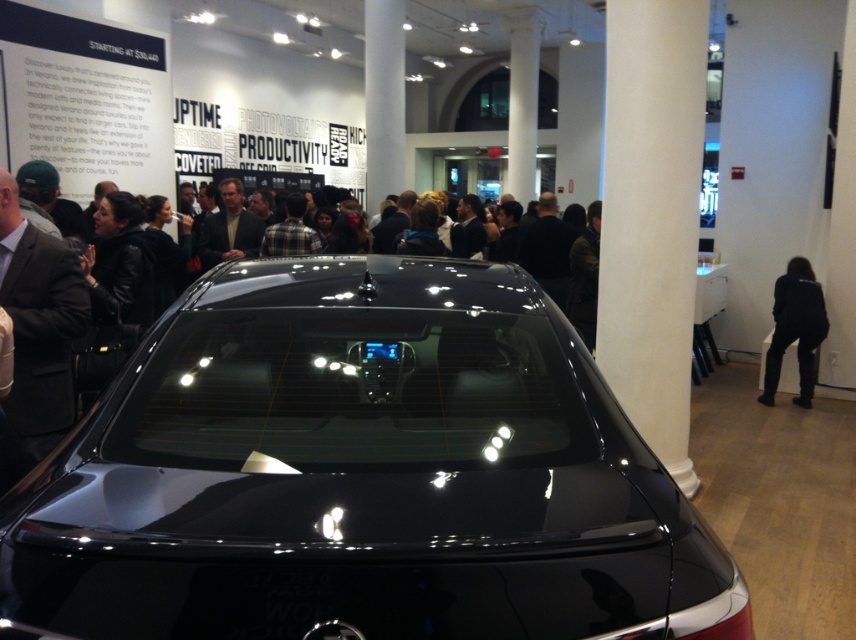
This screenshot has width=856, height=640. I want to click on glossy black car at center, so click(361, 474).

Who is more forward, (308,291) or (811,397)?

Point (308,291) is in front.

What do you see at coordinates (361, 474) in the screenshot? This screenshot has height=640, width=856. I see `glossy black car at center` at bounding box center [361, 474].

Identify the location of glossy black car at center. (361, 474).